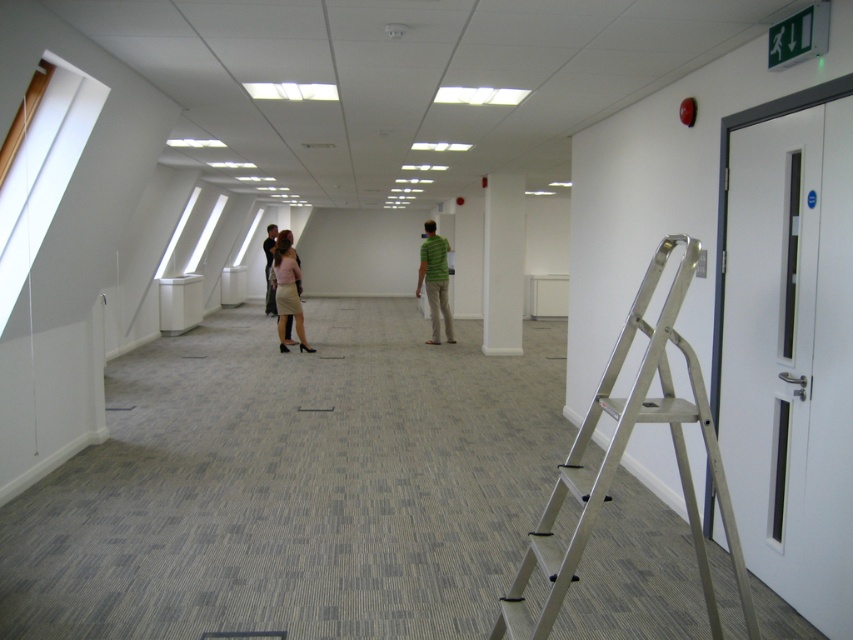
Measure the distance between green matte shirt at center and light brown leather jacket at center.

They are 12.94 feet apart.

Is point (432, 292) positioned behind point (270, 241)?

No.

Is point (436, 300) in front of point (271, 259)?

That is True.

Locate an element on the screen. This screenshot has width=853, height=640. green matte shirt at center is located at coordinates (434, 280).

Does green matte shirt at center have a larger size compared to matte beige skirt at center?

Indeed, green matte shirt at center has a larger size compared to matte beige skirt at center.

Is the position of green matte shirt at center less distant than that of matte beige skirt at center?

That is False.

Between point (444, 259) and point (283, 337), which one is positioned in front?

Positioned in front is point (283, 337).

Locate an element on the screen. The width and height of the screenshot is (853, 640). green matte shirt at center is located at coordinates (434, 280).

Does white smooth pillar at center lie behind light brown leather jacket at center?

No, it is in front of light brown leather jacket at center.

Between white smooth pillar at center and light brown leather jacket at center, which one is positioned lower?

white smooth pillar at center is lower down.

Is point (509, 272) in front of point (270, 262)?

Yes.

The image size is (853, 640). Identify the location of white smooth pillar at center. tap(503, 264).